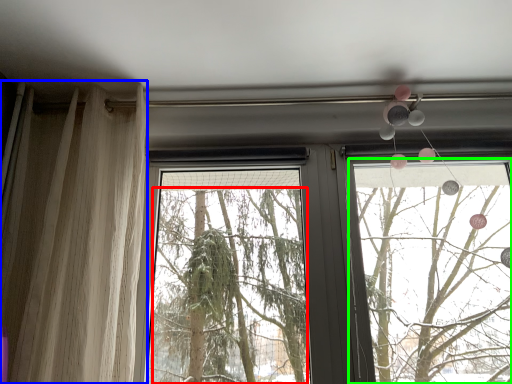
Question: Considering the real-world distances, which object is closest to tree (highlighted by a red box)? curtain (highlighted by a blue box) or window frame (highlighted by a green box).

Choices:
 (A) curtain
 (B) window frame

Answer: (B)